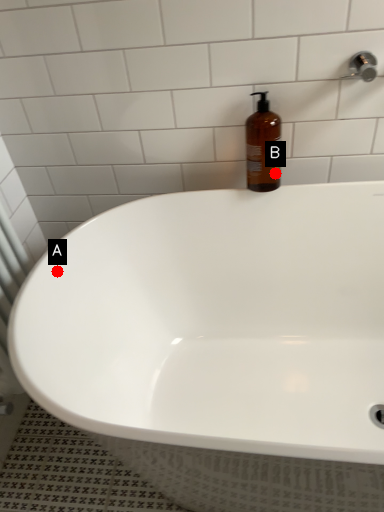
Question: Two points are circled on the image, labeled by A and B beside each circle. Which point is closer to the camera?

Choices:
 (A) A is closer
 (B) B is closer

Answer: (A)